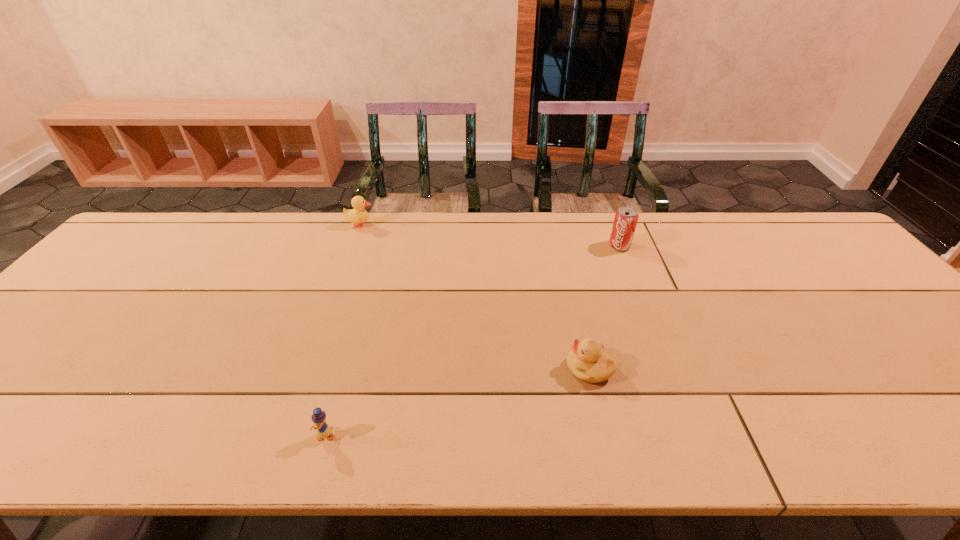
Find the location of a particular element. vacant space that satisfies the following two spatial constraints: 1. on the beak of the rightmost duckling; 2. on the face of the third object from right to left, where the monocle is placed is located at coordinates (605, 435).